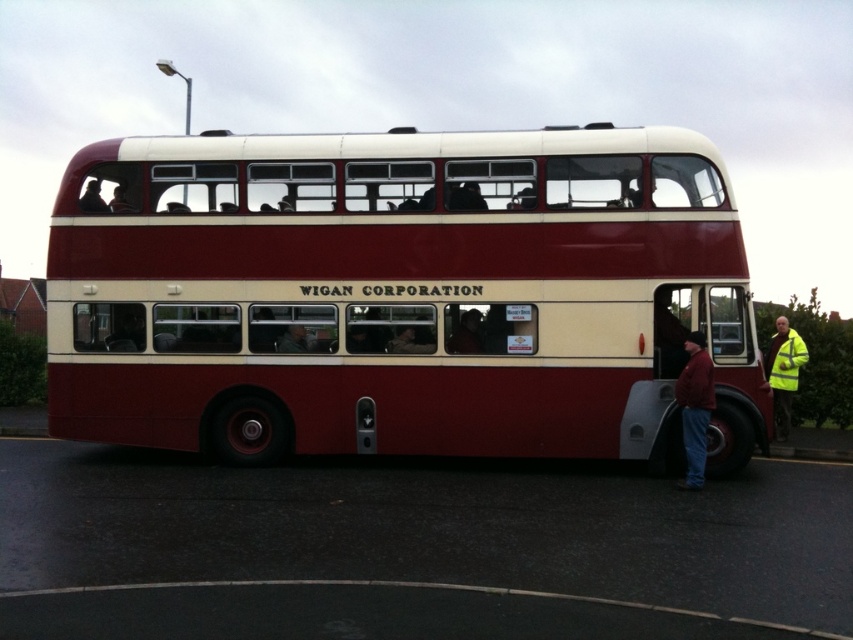
You are a safety inspector checking the visibility of reflective materials on the vintage double decker bus. The bus has a yellow reflective vest at lower right and smooth black hair at upper left. Which object is wider?

The yellow reflective vest at lower right might be wider than smooth black hair at upper left.

You are a pedestrian standing at the front of the vintage double decker bus. You want to cross the road safely. There is a yellow reflective vest at lower right. Where is the yellow reflective vest located relative to your position?

The yellow reflective vest at lower right is located at point 0.583 on the x axis and 0.919 on the y axis relative to your position at the front of the bus.